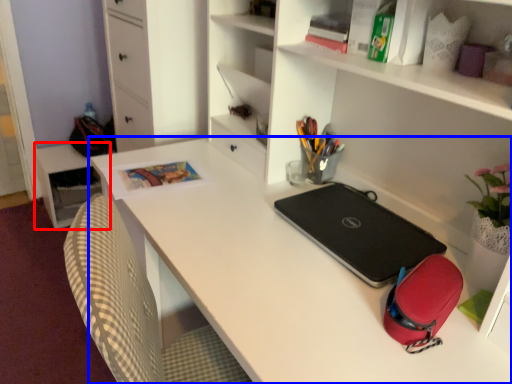
Question: Which object is further to the camera taking this photo, table (highlighted by a red box) or desk (highlighted by a blue box)?

Choices:
 (A) table
 (B) desk

Answer: (A)